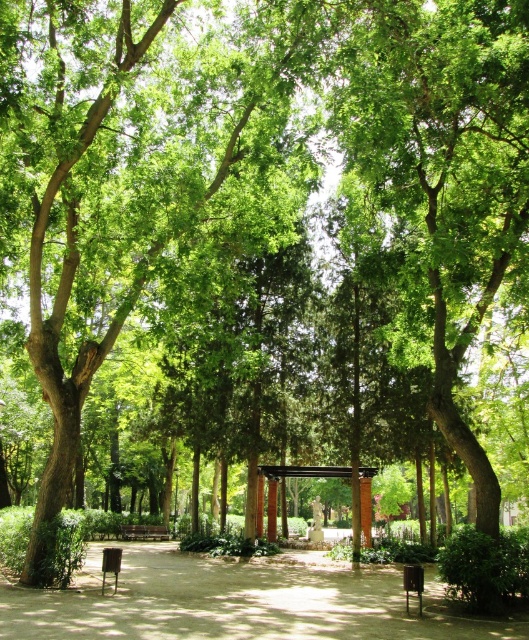
Question: Does brown dirt path at center lie behind brown wooden bench at center?

Choices:
 (A) no
 (B) yes

Answer: (A)

Question: Which of the following is the farthest from the observer?

Choices:
 (A) brown wooden bench at center
 (B) brown wooden pergola at center

Answer: (A)

Question: Which object is positioned farthest from the brown wooden bench at center?

Choices:
 (A) brown wooden pergola at center
 (B) brown dirt path at center

Answer: (B)

Question: Which point is farther to the camera?

Choices:
 (A) brown wooden bench at center
 (B) brown wooden pergola at center
 (C) brown dirt path at center

Answer: (A)

Question: Can you confirm if brown wooden pergola at center is wider than brown wooden bench at center?

Choices:
 (A) no
 (B) yes

Answer: (A)

Question: Is brown dirt path at center further to camera compared to brown wooden bench at center?

Choices:
 (A) yes
 (B) no

Answer: (B)